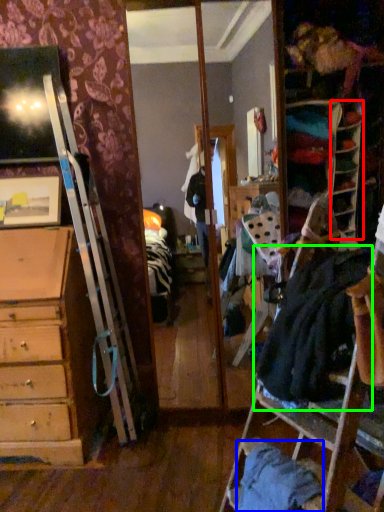
Question: Considering the real-world distances, which object is farthest from shelf (highlighted by a red box)? clothing (highlighted by a blue box) or clothing (highlighted by a green box)?

Choices:
 (A) clothing
 (B) clothing

Answer: (A)